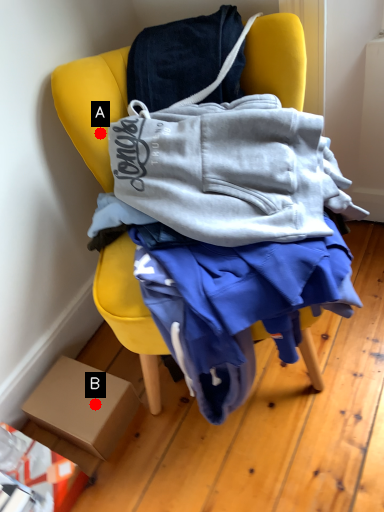
Question: Two points are circled on the image, labeled by A and B beside each circle. Which point appears closest to the camera in this image?

Choices:
 (A) A is closer
 (B) B is closer

Answer: (A)